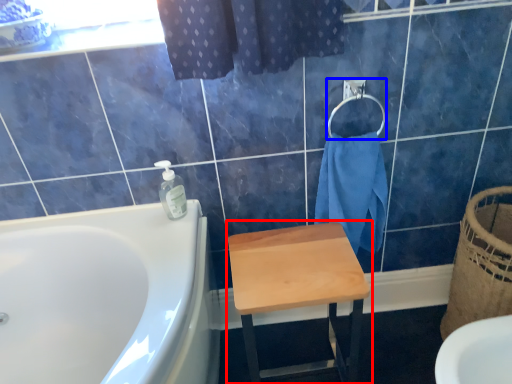
Question: Among these objects, which one is nearest to the camera, stool (highlighted by a red box) or towel bar (highlighted by a blue box)?

Choices:
 (A) stool
 (B) towel bar

Answer: (A)